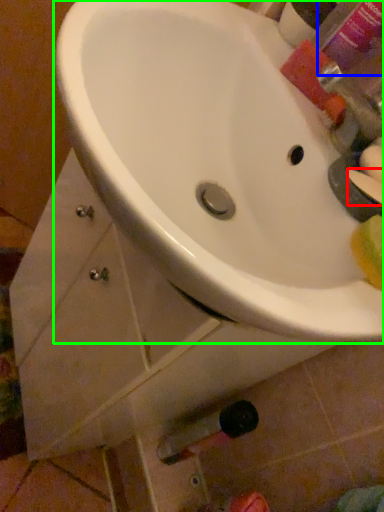
Question: Considering the real-world distances, which object is farthest from soap (highlighted by a red box)? mouthwash (highlighted by a blue box) or sink (highlighted by a green box)?

Choices:
 (A) mouthwash
 (B) sink

Answer: (A)